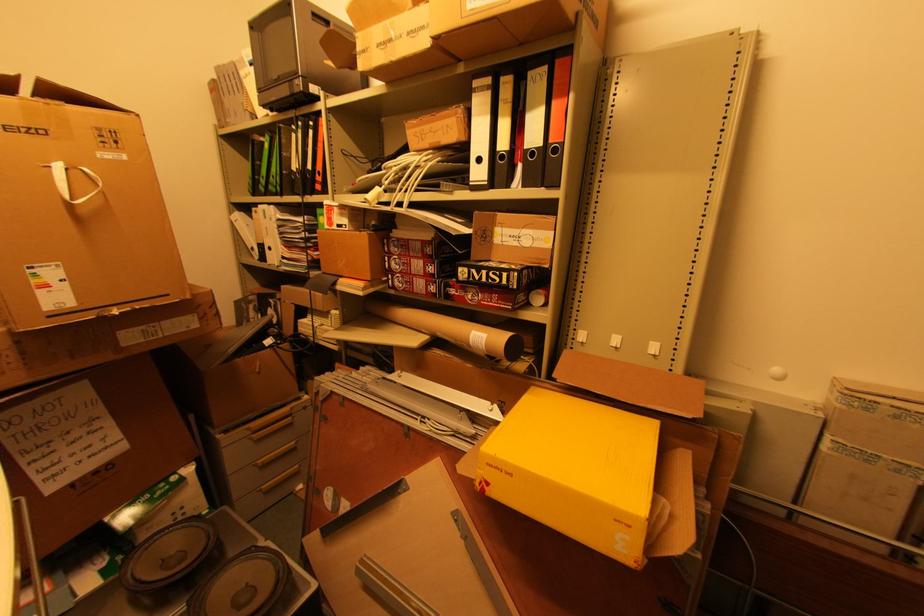
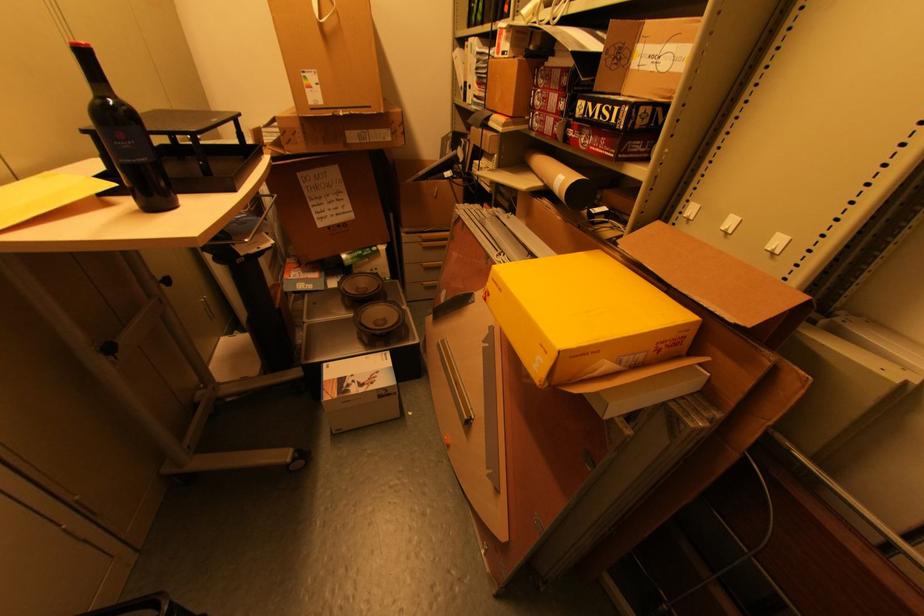
Find the pixel in the second image that matches the point at 490,302 in the first image.

(599, 148)